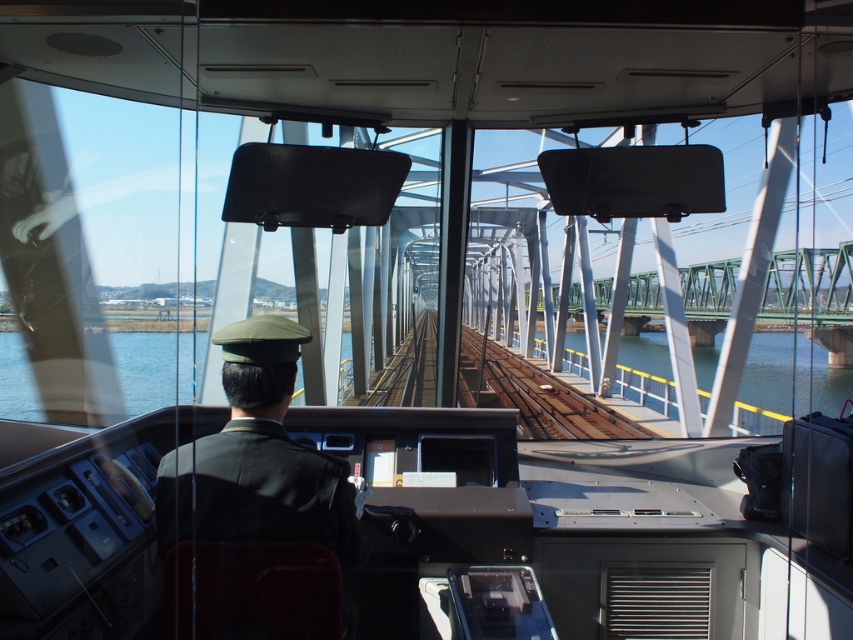
The image size is (853, 640). Describe the element at coordinates (810, 285) in the screenshot. I see `green metallic bridge at center` at that location.

From the picture: Between green metallic bridge at center and clear blue water at track right, which one appears on the right side from the viewer's perspective?

clear blue water at track right is more to the right.

Locate an element on the screen. The width and height of the screenshot is (853, 640). green metallic bridge at center is located at coordinates (810, 285).

Between point (231, 333) and point (784, 364), which one is positioned in front?

Positioned in front is point (231, 333).

Measure the distance between point (305, 484) and camera.

A distance of 6.32 feet exists between point (305, 484) and camera.

Where is `dark green uniform at center`? dark green uniform at center is located at coordinates (257, 458).

Find the location of a particular element. Image resolution: width=853 pixels, height=640 pixels. dark green uniform at center is located at coordinates (257, 458).

Who is positioned more to the right, blue water at center or clear blue water at track right?

clear blue water at track right is more to the right.

Is blue water at center wider than clear blue water at track right?

Yes, blue water at center is wider than clear blue water at track right.

Measure the distance between blue water at center and camera.

blue water at center is 4.29 meters away from camera.

In order to click on blue water at center in this screenshot , I will do `click(764, 369)`.